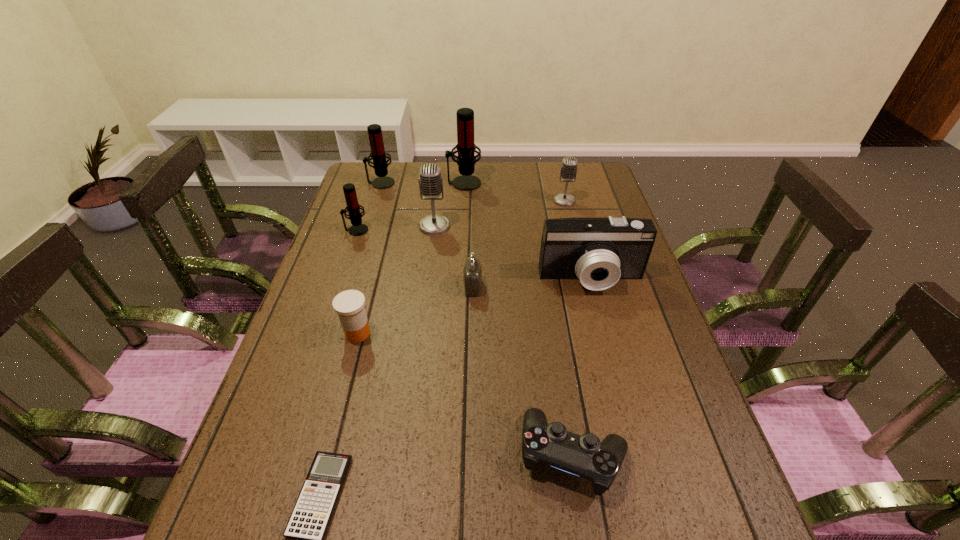
Where is `vacant space located at the front of the padlock near the keyhole`? This screenshot has height=540, width=960. vacant space located at the front of the padlock near the keyhole is located at coordinates (529, 287).

Identify the location of vacant space located on the label of the medicine. The height and width of the screenshot is (540, 960). (345, 384).

In order to click on medicine located at the left edge in this screenshot , I will do `click(349, 305)`.

Locate an element on the screen. This screenshot has height=540, width=960. camcorder located in the right edge section of the desktop is located at coordinates (599, 251).

Find the location of a particular element. The height and width of the screenshot is (540, 960). microphone located at the right edge is located at coordinates (568, 171).

You are a GUI agent. You are given a task and a screenshot of the screen. Output one action in this format:
    pyautogui.click(x=<x>, y=<y>)
    Task: Click on the object that is at the far left corner
    The height and width of the screenshot is (540, 960).
    Given the screenshot: What is the action you would take?
    pyautogui.click(x=378, y=154)

At what (x,y) coordinates should I click in order to perform the action: click on object that is at the far right corner. Please return your answer as a coordinate pair (x, y). This screenshot has height=540, width=960. Looking at the image, I should click on point(568,171).

Identify the location of vacant region at the far edge of the desktop. The image size is (960, 540). (492, 190).

The width and height of the screenshot is (960, 540). In the image, there is a desktop. In order to click on vacant space at the near edge in this screenshot , I will do `click(463, 539)`.

The image size is (960, 540). What are the coordinates of `vacant space at the left edge` in the screenshot? It's located at (367, 255).